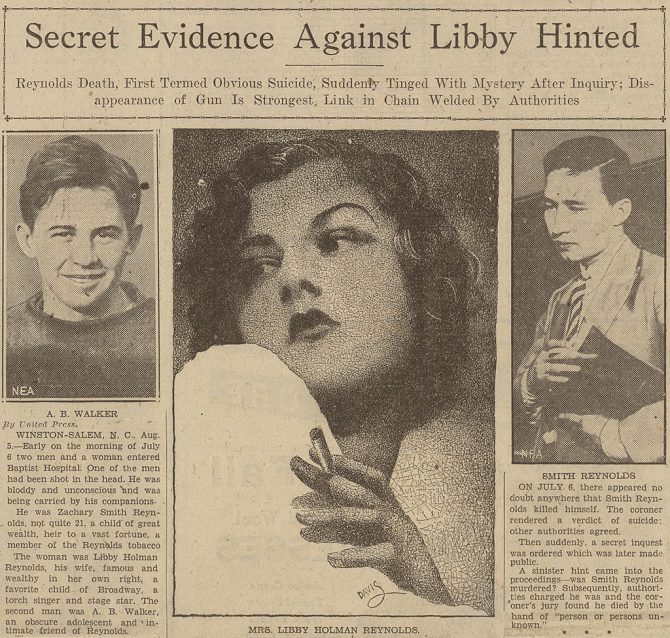
Image resolution: width=670 pixels, height=638 pixels. Find the location of `news paper`. news paper is located at coordinates (327, 256).